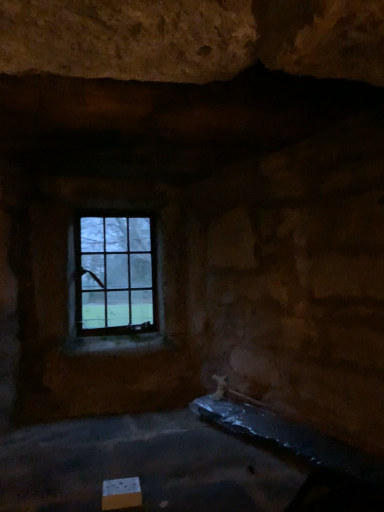
Question: From a real-world perspective, is clear glass window at upper center positioned over white cardboard box at lower left based on gravity?

Choices:
 (A) no
 (B) yes

Answer: (B)

Question: Can you confirm if clear glass window at upper center is taller than white cardboard box at lower left?

Choices:
 (A) no
 (B) yes

Answer: (B)

Question: Is clear glass window at upper center to the right of white cardboard box at lower left from the viewer's perspective?

Choices:
 (A) no
 (B) yes

Answer: (A)

Question: Considering the relative sizes of clear glass window at upper center and white cardboard box at lower left in the image provided, is clear glass window at upper center smaller than white cardboard box at lower left?

Choices:
 (A) yes
 (B) no

Answer: (B)

Question: Is clear glass window at upper center facing towards white cardboard box at lower left?

Choices:
 (A) yes
 (B) no

Answer: (A)

Question: Is clear glass window at upper center outside white cardboard box at lower left?

Choices:
 (A) no
 (B) yes

Answer: (B)

Question: From the image's perspective, would you say white cardboard box at lower left is positioned over clear glass window at upper center?

Choices:
 (A) no
 (B) yes

Answer: (A)

Question: Is white cardboard box at lower left oriented towards clear glass window at upper center?

Choices:
 (A) no
 (B) yes

Answer: (A)

Question: From the image's perspective, would you say white cardboard box at lower left is shown under clear glass window at upper center?

Choices:
 (A) yes
 (B) no

Answer: (A)

Question: From a real-world perspective, is white cardboard box at lower left over clear glass window at upper center?

Choices:
 (A) yes
 (B) no

Answer: (B)

Question: Is white cardboard box at lower left directly adjacent to clear glass window at upper center?

Choices:
 (A) no
 (B) yes

Answer: (A)

Question: Is white cardboard box at lower left positioned far away from clear glass window at upper center?

Choices:
 (A) no
 (B) yes

Answer: (B)

Question: From the image's perspective, is white cardboard box at lower left located above or below clear glass window at upper center?

Choices:
 (A) above
 (B) below

Answer: (B)